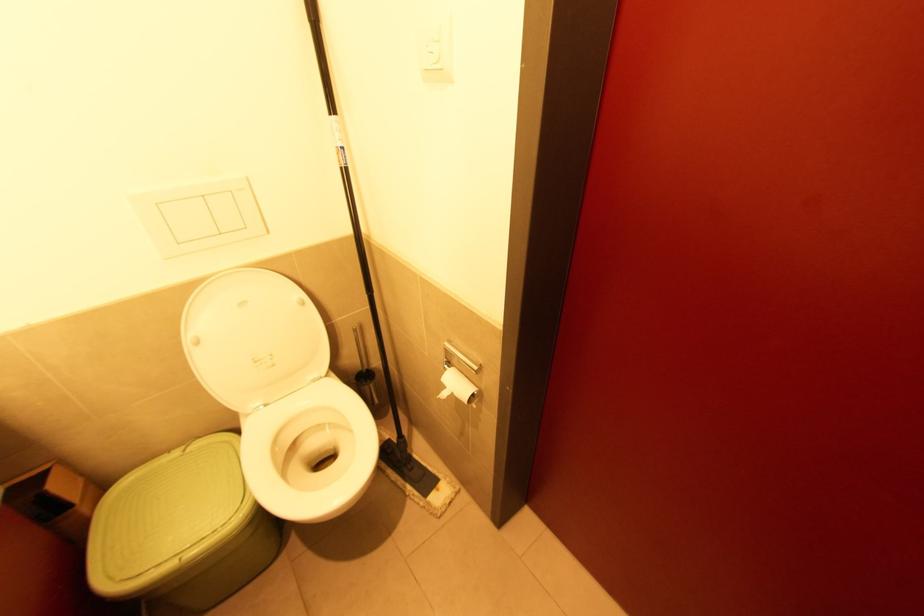
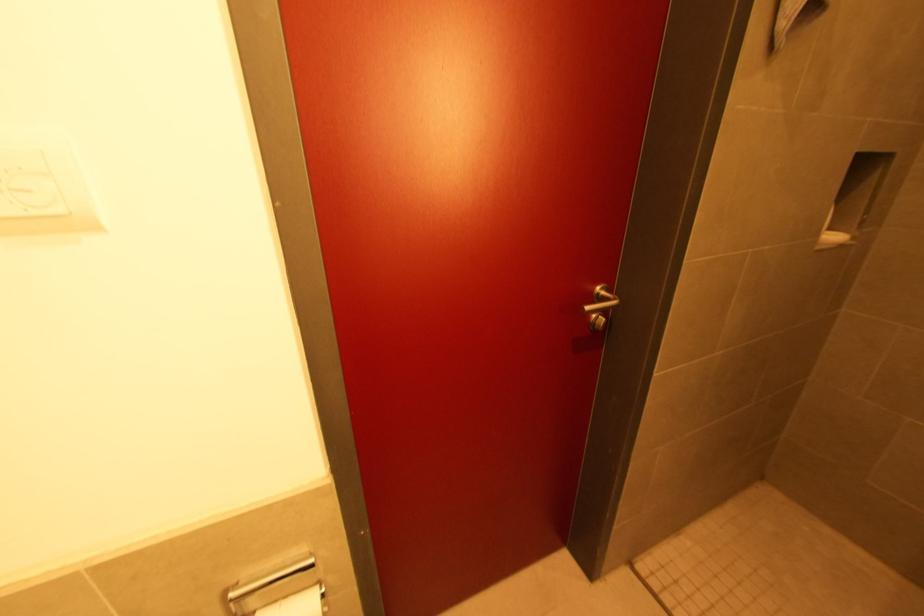
Where in the second image is the point corresponding to point (477, 394) from the first image?

(323, 591)